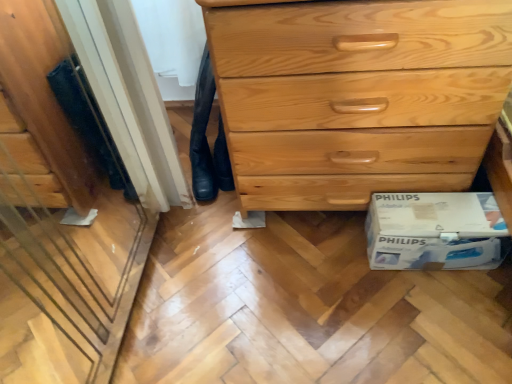
Where is `free spot in front of light wood chest of drawers at center`? free spot in front of light wood chest of drawers at center is located at coordinates (348, 309).